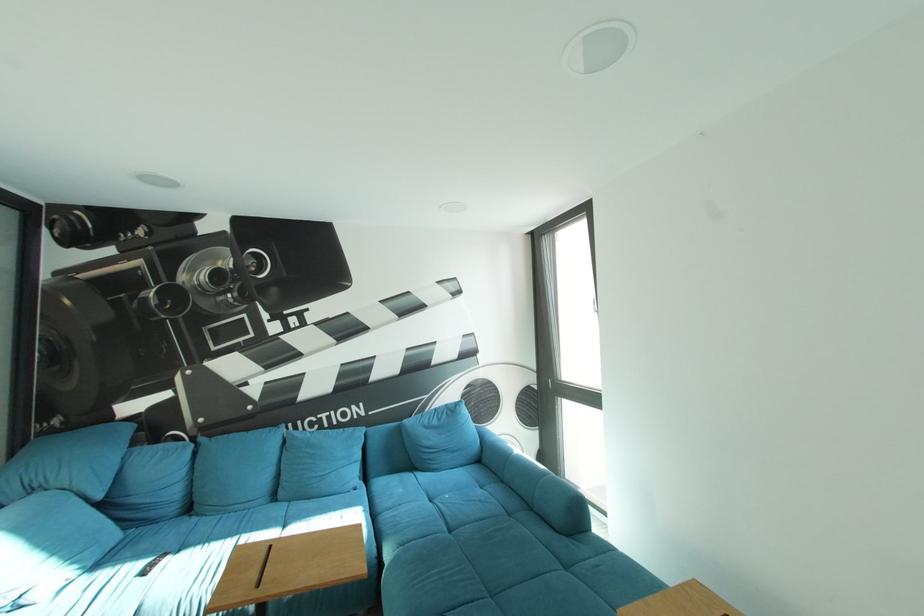
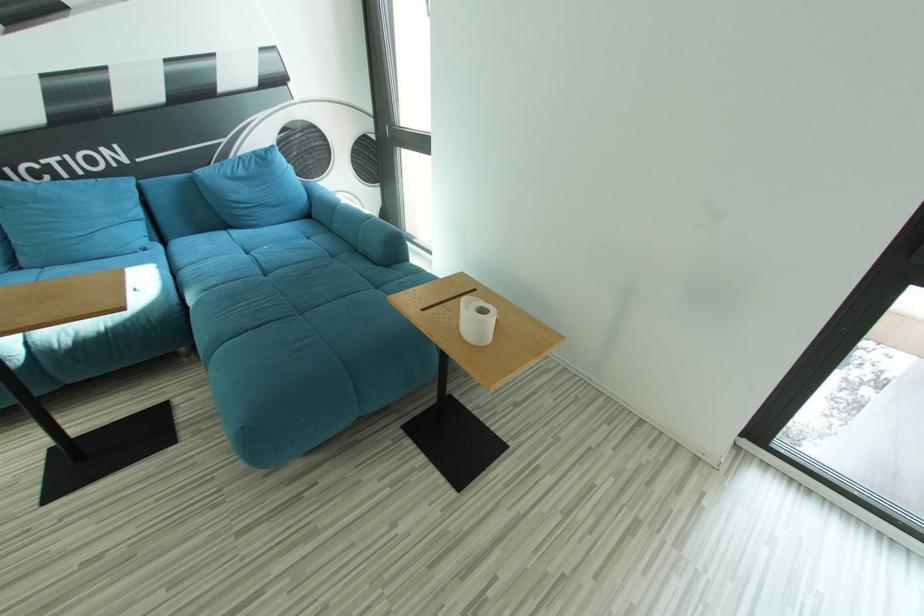
First-person continuous shooting, in which direction is the camera rotating?

The camera's rotation is toward right-down.